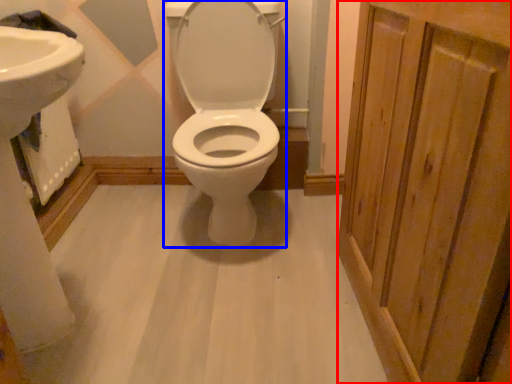
Question: Which of the following is the farthest to the observer, screen door (highlighted by a red box) or toilet (highlighted by a blue box)?

Choices:
 (A) screen door
 (B) toilet

Answer: (B)